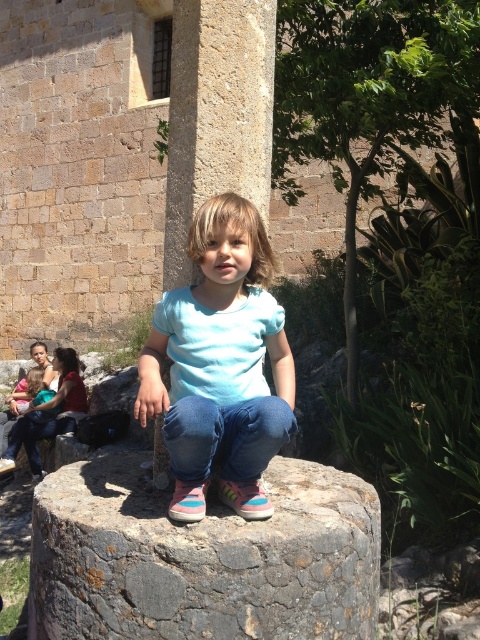
Question: Which point is closer to the camera?

Choices:
 (A) rusty stone boulder at center
 (B) light blue cotton shirt at center
 (C) denim jeans at lower left
 (D) light blue t-shirt at center

Answer: (B)

Question: Can you confirm if light blue t-shirt at center is thinner than denim jeans at lower left?

Choices:
 (A) yes
 (B) no

Answer: (B)

Question: Which object appears closest to the camera in this image?

Choices:
 (A) denim at center
 (B) rusty stone boulder at center
 (C) light blue cotton shirt at center

Answer: (C)

Question: Based on their relative distances, which object is nearer to the rusty stone boulder at center?

Choices:
 (A) denim jeans at lower left
 (B) denim at center

Answer: (B)

Question: Does light blue cotton shirt at center appear under light blue t-shirt at center?

Choices:
 (A) yes
 (B) no

Answer: (B)

Question: Can you confirm if rusty stone boulder at center is positioned to the right of light blue t-shirt at center?

Choices:
 (A) no
 (B) yes

Answer: (B)